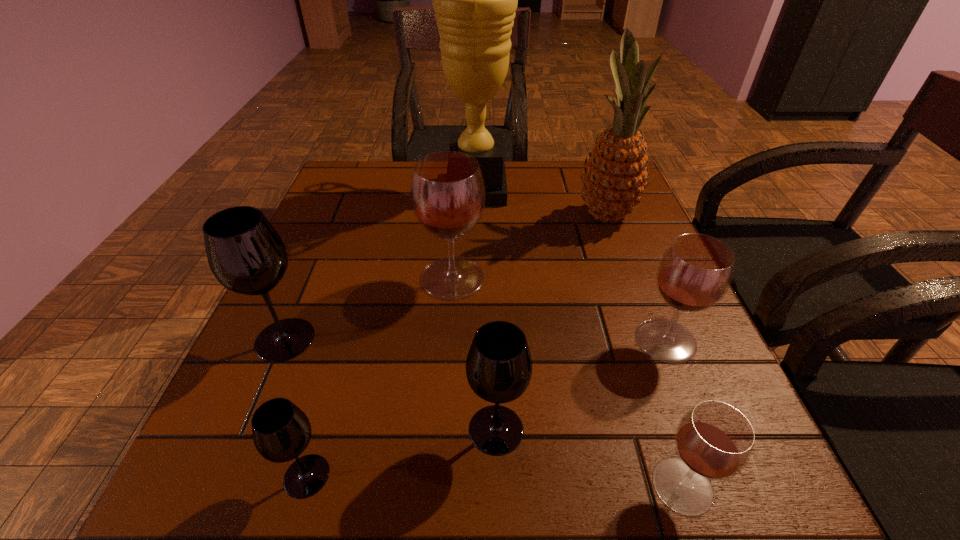
At what (x,y) coordinates should I click in order to perform the action: click on yellow trophy cup. Please return your answer as a coordinate pair (x, y). The height and width of the screenshot is (540, 960). Looking at the image, I should click on 474,0.

Where is `the tallest object`? The width and height of the screenshot is (960, 540). the tallest object is located at coordinates (474, 0).

At what (x,y) coordinates should I click in order to perform the action: click on the second tallest object. Please return your answer as a coordinate pair (x, y). The image size is (960, 540). Looking at the image, I should click on (615, 175).

Where is `the leftmost red wineglass`? This screenshot has width=960, height=540. the leftmost red wineglass is located at coordinates (447, 191).

Identify the location of the farthest wineglass. (447, 191).

Locate an element on the screen. This screenshot has height=540, width=960. the biggest gray wineglass is located at coordinates (245, 253).

Where is `the leftmost object`? This screenshot has height=540, width=960. the leftmost object is located at coordinates (245, 253).

Image resolution: width=960 pixels, height=540 pixels. In order to click on the second smallest red wineglass in this screenshot , I will do `click(694, 273)`.

The width and height of the screenshot is (960, 540). I want to click on the second smallest gray wineglass, so click(498, 367).

You are a GUI agent. You are given a task and a screenshot of the screen. Output one action in this format:
    pyautogui.click(x=<x>, y=<y>)
    Task: Click on the smallest gray wineglass
    Image resolution: width=960 pixels, height=540 pixels.
    Given the screenshot: What is the action you would take?
    pyautogui.click(x=281, y=431)